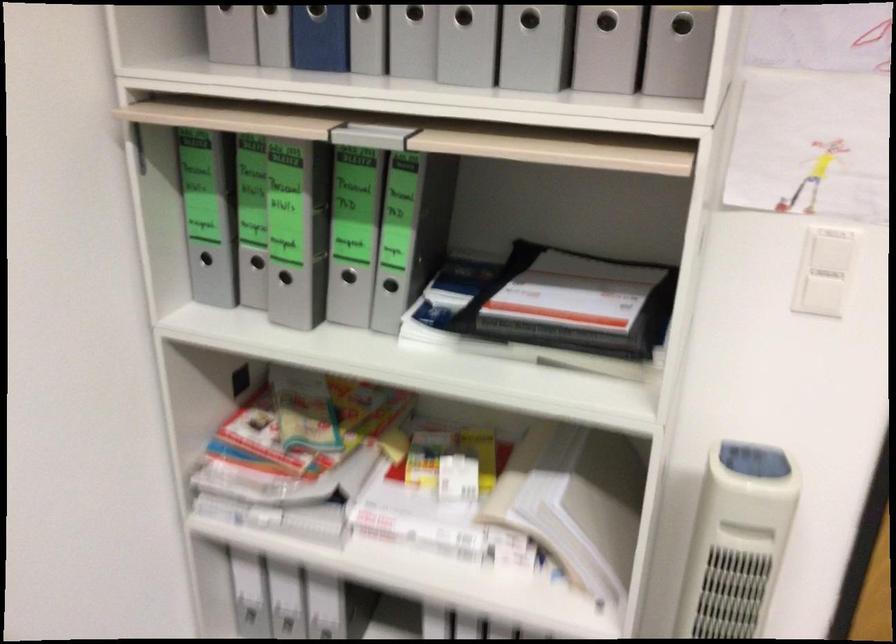
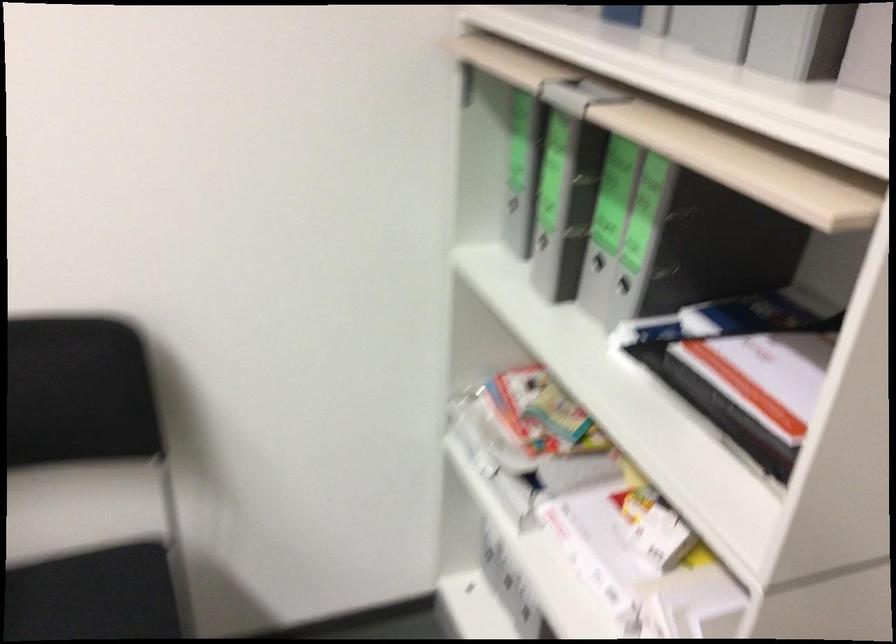
Question: The images are taken continuously from a first-person perspective. In which direction is your viewpoint rotating?

Choices:
 (A) Left
 (B) Right
 (C) Up
 (D) Down

Answer: (A)